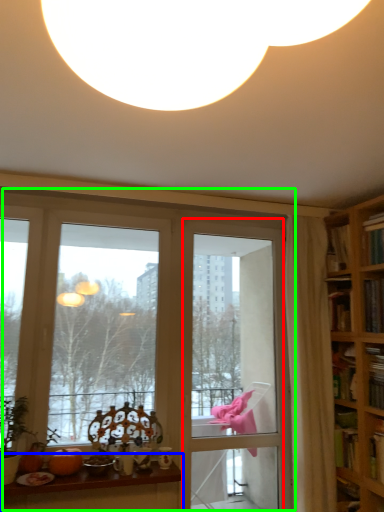
Question: Which is farther away from screen door (highlighted by a red box)? table (highlighted by a blue box) or window (highlighted by a green box)?

Choices:
 (A) table
 (B) window

Answer: (A)